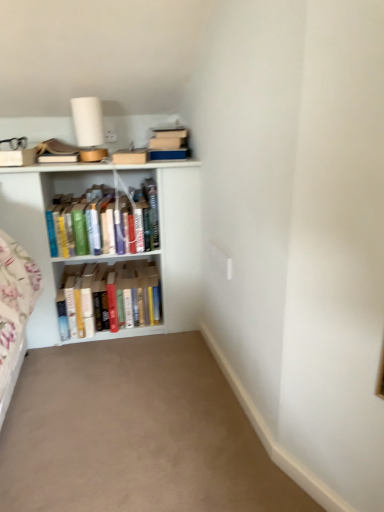
Question: Is hardcover books at center, which appears as the first book when ordered from the bottom, facing towards beige carpet at lower center?

Choices:
 (A) yes
 (B) no

Answer: (A)

Question: Is hardcover books at center, which appears as the first book when ordered from the bottom, thinner than beige carpet at lower center?

Choices:
 (A) no
 (B) yes

Answer: (B)

Question: Is hardcover books at center, which appears as the first book when ordered from the bottom, not close to beige carpet at lower center?

Choices:
 (A) yes
 (B) no

Answer: (B)

Question: From the image's perspective, is hardcover books at center, which is the 2th book from top to bottom, located above beige carpet at lower center?

Choices:
 (A) yes
 (B) no

Answer: (A)

Question: Does hardcover books at center, which is the 2th book from top to bottom, appear on the left side of beige carpet at lower center?

Choices:
 (A) yes
 (B) no

Answer: (A)

Question: Does point (104, 321) appear closer or farther from the camera than point (66, 228)?

Choices:
 (A) farther
 (B) closer

Answer: (A)

Question: Is hardcover books at center, which is the 2th book from top to bottom, taller or shorter than hardcover books at center, arranged as the first book when viewed from the top?

Choices:
 (A) tall
 (B) short

Answer: (B)

Question: Based on their sizes in the image, would you say hardcover books at center, which appears as the first book when ordered from the bottom, is bigger or smaller than hardcover books at center, which is counted as the 2th book, starting from the bottom?

Choices:
 (A) small
 (B) big

Answer: (A)

Question: From a real-world perspective, is hardcover books at center, which appears as the first book when ordered from the bottom, positioned above or below hardcover books at center, arranged as the first book when viewed from the top?

Choices:
 (A) above
 (B) below

Answer: (B)

Question: In the image, is hardcover books at center, arranged as the first book when viewed from the top, on the left side or the right side of beige carpet at lower center?

Choices:
 (A) left
 (B) right

Answer: (A)

Question: Is hardcover books at center, which is counted as the 2th book, starting from the bottom, taller or shorter than beige carpet at lower center?

Choices:
 (A) short
 (B) tall

Answer: (B)

Question: Based on their sizes in the image, would you say hardcover books at center, arranged as the first book when viewed from the top, is bigger or smaller than beige carpet at lower center?

Choices:
 (A) small
 (B) big

Answer: (B)

Question: Is hardcover books at center, arranged as the first book when viewed from the top, inside the boundaries of beige carpet at lower center, or outside?

Choices:
 (A) outside
 (B) inside

Answer: (A)

Question: Relative to white wooden bookshelf at left, is hardcover books at center, which is counted as the 2th book, starting from the bottom, in front or behind?

Choices:
 (A) front
 (B) behind

Answer: (B)

Question: Is hardcover books at center, which is counted as the 2th book, starting from the bottom, bigger or smaller than white wooden bookshelf at left?

Choices:
 (A) small
 (B) big

Answer: (A)